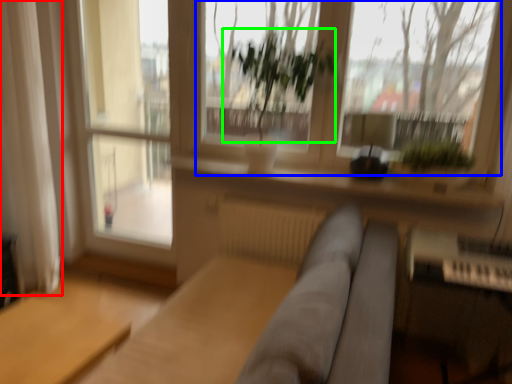
Question: Which object is the farthest from curtain (highlighted by a red box)? Choose among these: window screen (highlighted by a blue box) or vegetation (highlighted by a green box).

Choices:
 (A) window screen
 (B) vegetation

Answer: (A)